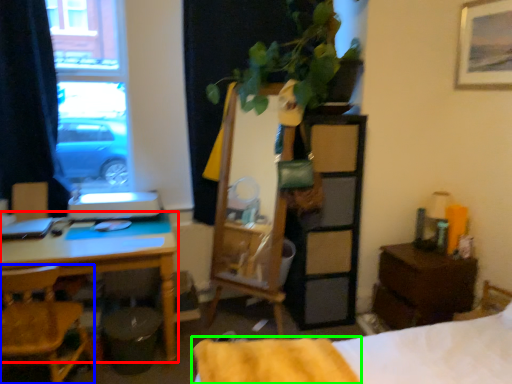
Question: Considering the real-world distances, which object is farthest from desk (highlighted by a red box)? chair (highlighted by a blue box) or blanket (highlighted by a green box)?

Choices:
 (A) chair
 (B) blanket

Answer: (B)